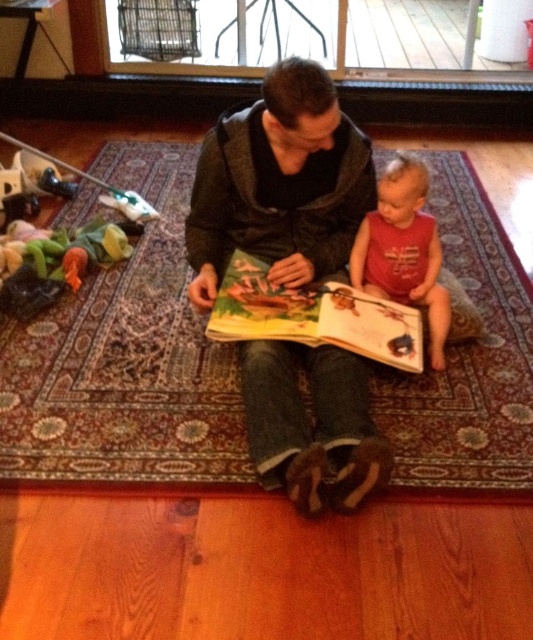
You are a clothing designer who wants to create a new line of children and adult clothing. You observe the dark gray hoodie at center and the red cotton shirt at center in the image. Which clothing item has a greater width measurement?

The dark gray hoodie at center has a greater width measurement than the red cotton shirt at center according to the description provided.

You are standing in the room and want to place a 1.5 meter long decorative banner between the adult and the child. The banner needs to be placed at the point marked as point (238, 298). Is there enough space between the adult and the child to place the banner at that point?

The point marked as point (238, 298) is 1.79 meters away from the camera, which is more than enough space to place a 1.5 meter long decorative banner between the adult and the child.

You are standing in the room and want to place a 1.5 meter long ladder against the wall behind the point at coordinates point (319, 179). Will the ladder fit without overlapping the point?

The point at coordinates point (319, 179) is 1.77 meters from the viewer. Since the ladder is 1.5 meters long, it will fit as it is shorter than the distance to the point, so placing it there won